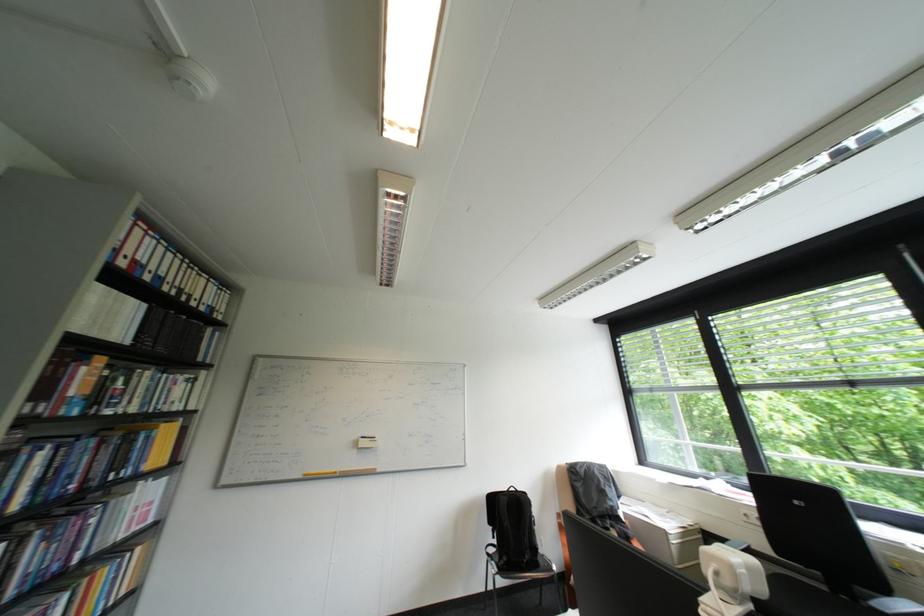
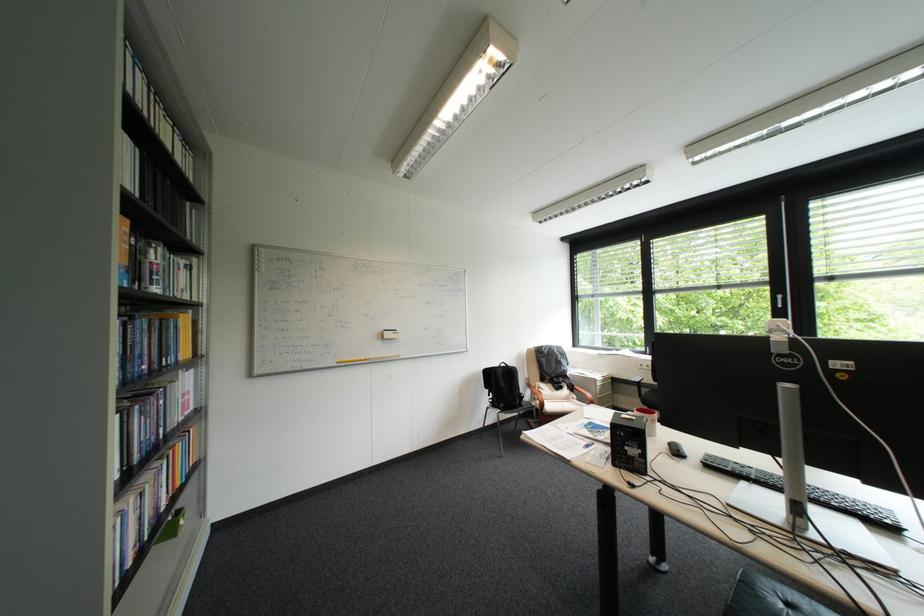
The point at (318, 474) is marked in the first image. Where is the corresponding point in the second image?

(350, 361)